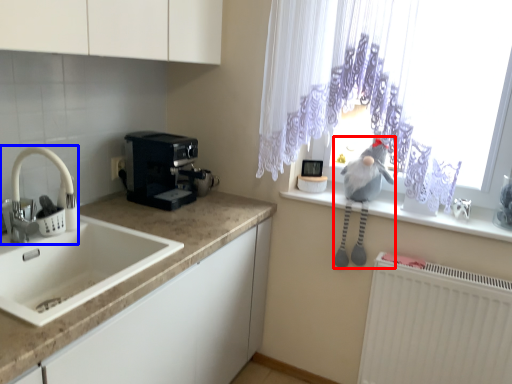
Question: Among these objects, which one is farthest to the camera, animal (highlighted by a red box) or tap (highlighted by a blue box)?

Choices:
 (A) animal
 (B) tap

Answer: (A)